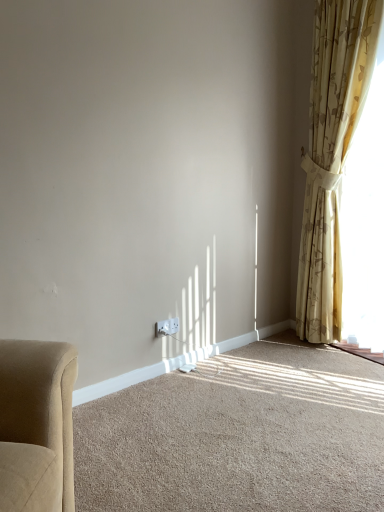
Question: Considering the relative positions of beige carpet at lower center and yellow floral curtain at right in the image provided, is beige carpet at lower center to the right of yellow floral curtain at right from the viewer's perspective?

Choices:
 (A) no
 (B) yes

Answer: (A)

Question: From a real-world perspective, is beige carpet at lower center physically below yellow floral curtain at right?

Choices:
 (A) yes
 (B) no

Answer: (A)

Question: Is yellow floral curtain at right surrounded by beige carpet at lower center?

Choices:
 (A) no
 (B) yes

Answer: (A)

Question: Can you confirm if beige carpet at lower center is wider than yellow floral curtain at right?

Choices:
 (A) no
 (B) yes

Answer: (B)

Question: Does beige carpet at lower center lie behind yellow floral curtain at right?

Choices:
 (A) no
 (B) yes

Answer: (A)

Question: Would you say beige carpet at lower center is outside yellow floral curtain at right?

Choices:
 (A) yes
 (B) no

Answer: (A)

Question: Is beige carpet at lower center at the back of yellow floral curtain at right?

Choices:
 (A) no
 (B) yes

Answer: (A)

Question: Considering the relative positions of yellow floral curtain at right and beige carpet at lower center in the image provided, is yellow floral curtain at right to the right of beige carpet at lower center from the viewer's perspective?

Choices:
 (A) yes
 (B) no

Answer: (A)

Question: From a real-world perspective, does yellow floral curtain at right stand above beige carpet at lower center?

Choices:
 (A) no
 (B) yes

Answer: (B)

Question: From the image's perspective, would you say yellow floral curtain at right is shown under beige carpet at lower center?

Choices:
 (A) no
 (B) yes

Answer: (A)

Question: Would you say yellow floral curtain at right is a long distance from beige carpet at lower center?

Choices:
 (A) no
 (B) yes

Answer: (B)

Question: Does yellow floral curtain at right come behind beige carpet at lower center?

Choices:
 (A) yes
 (B) no

Answer: (A)

Question: Can you confirm if white plastic electric outlet at lower center is bigger than beige carpet at lower center?

Choices:
 (A) no
 (B) yes

Answer: (A)